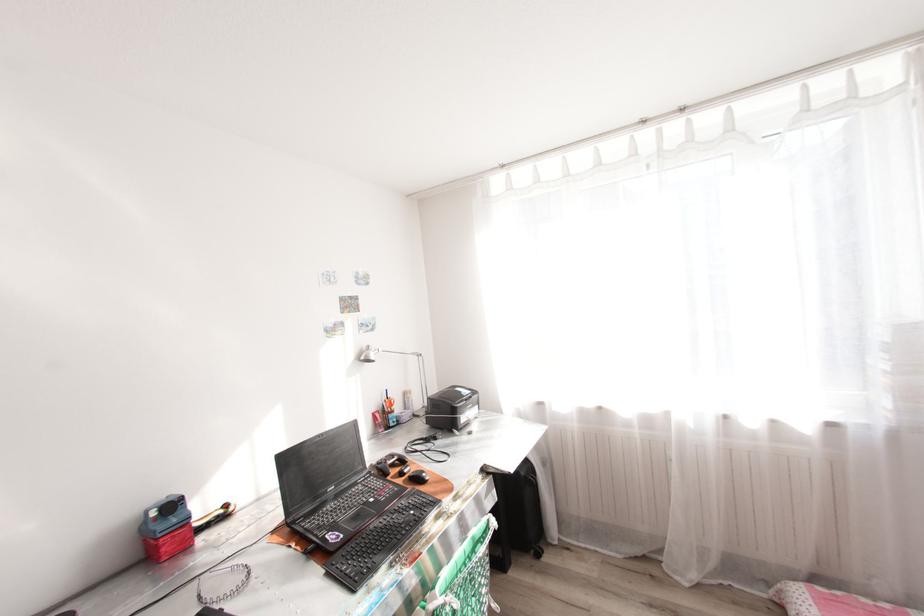
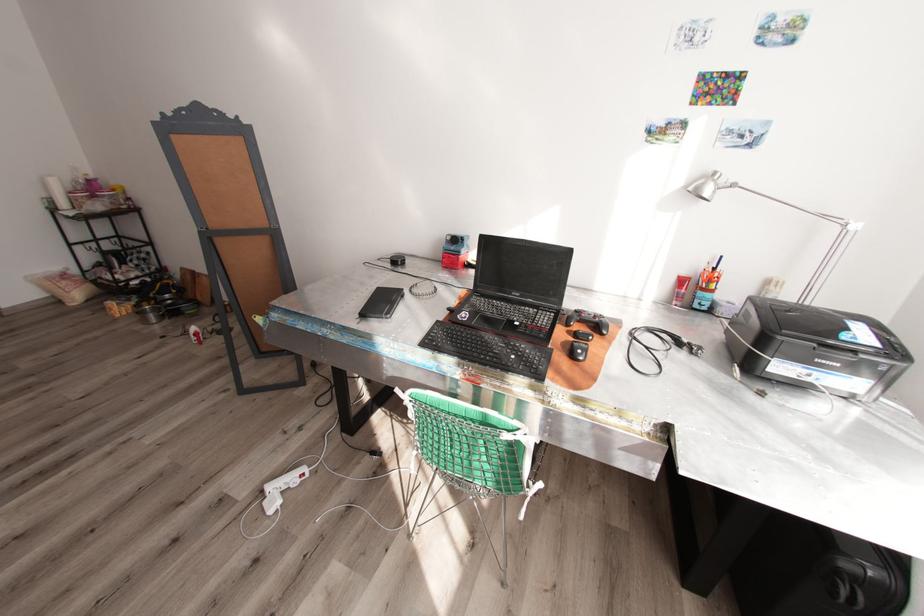
The point at [396,424] is marked in the first image. Where is the corresponding point in the second image?

(699, 305)